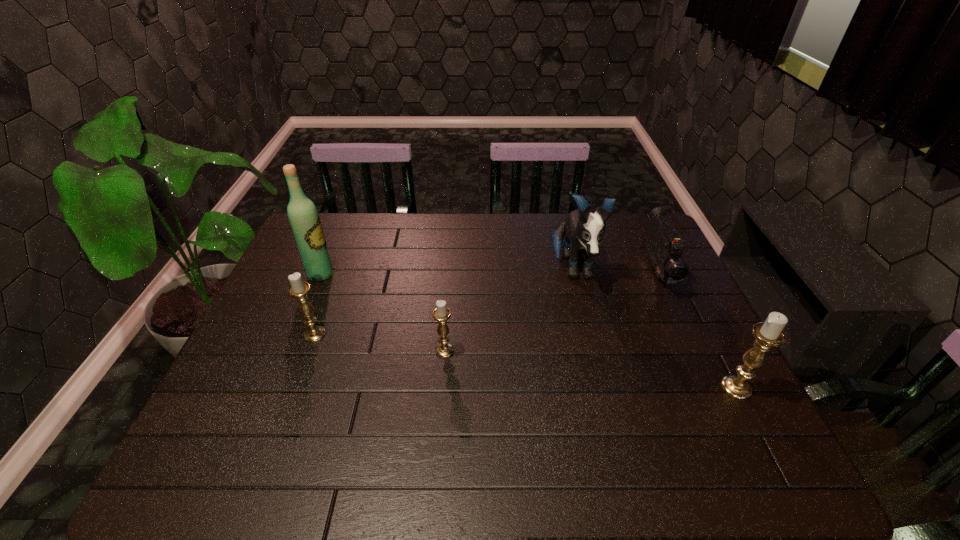
Identify the location of vacant space that satisfies the following two spatial constraints: 1. on the front-facing side of the camcorder; 2. on the front-facing side of the wine bottle. Image resolution: width=960 pixels, height=540 pixels. (659, 274).

At what (x,y) coordinates should I click in order to perform the action: click on vacant space that satisfies the following two spatial constraints: 1. on the front-facing side of the wine bottle; 2. on the back side of the fourth farthest object. Please return your answer as a coordinate pair (x, y). This screenshot has height=540, width=960. Looking at the image, I should click on (296, 334).

What are the coordinates of `free space that satisfies the following two spatial constraints: 1. on the front-facing side of the rightmost candle holder; 2. on the left side of the wine bottle` in the screenshot? It's located at (274, 388).